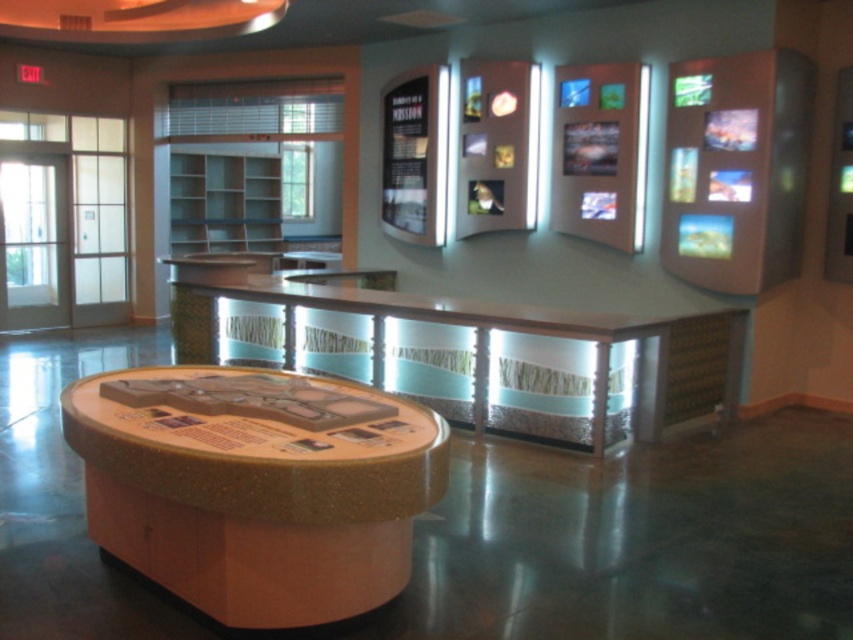
Question: Which point is farther from the camera taking this photo?

Choices:
 (A) (717, 419)
 (B) (326, 531)

Answer: (A)

Question: From the image, what is the correct spatial relationship of wooden textured table at center in relation to smooth polished wood table at center?

Choices:
 (A) below
 (B) above

Answer: (A)

Question: Among these objects, which one is farthest from the camera?

Choices:
 (A) wooden textured table at center
 (B) smooth polished wood table at center

Answer: (B)

Question: Can you confirm if wooden textured table at center is thinner than smooth polished wood table at center?

Choices:
 (A) no
 (B) yes

Answer: (B)

Question: Which object is closer to the camera taking this photo?

Choices:
 (A) wooden textured table at center
 (B) smooth polished wood table at center

Answer: (A)

Question: Observing the image, what is the correct spatial positioning of wooden textured table at center in reference to smooth polished wood table at center?

Choices:
 (A) below
 (B) above

Answer: (A)